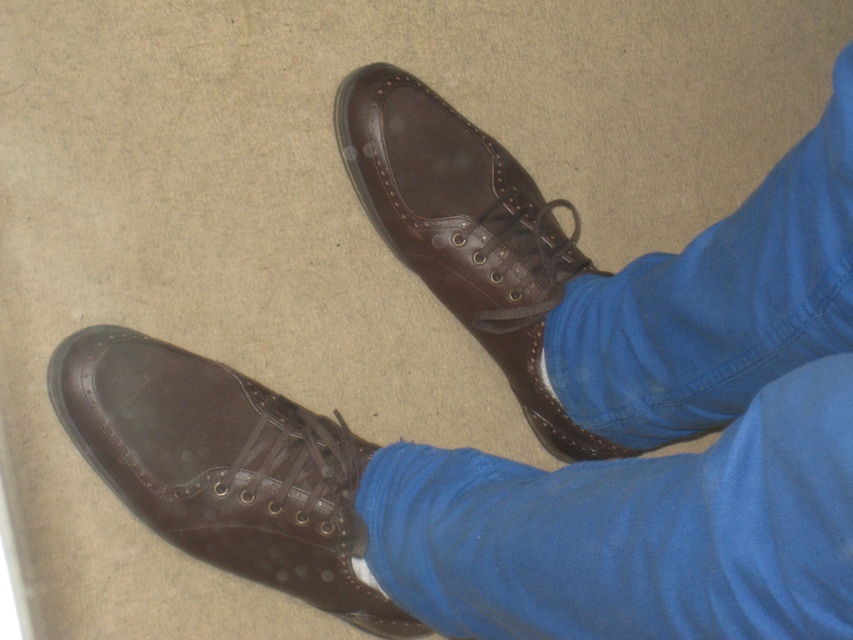
You are a shoe organizer who needs to arrange these two shiny brown shoes in a display case. The display case has a shelf that can only accommodate items spaced 12 inches apart. Can both the shiny brown shoe at lower left and the shiny brown leather shoe at center fit on the same shelf without overlapping?

The distance between the shiny brown shoe at lower left and the shiny brown leather shoe at center is 11.27 inches, which is less than the 12 inches required by the display case. Therefore, both shoes can fit on the same shelf without overlapping.